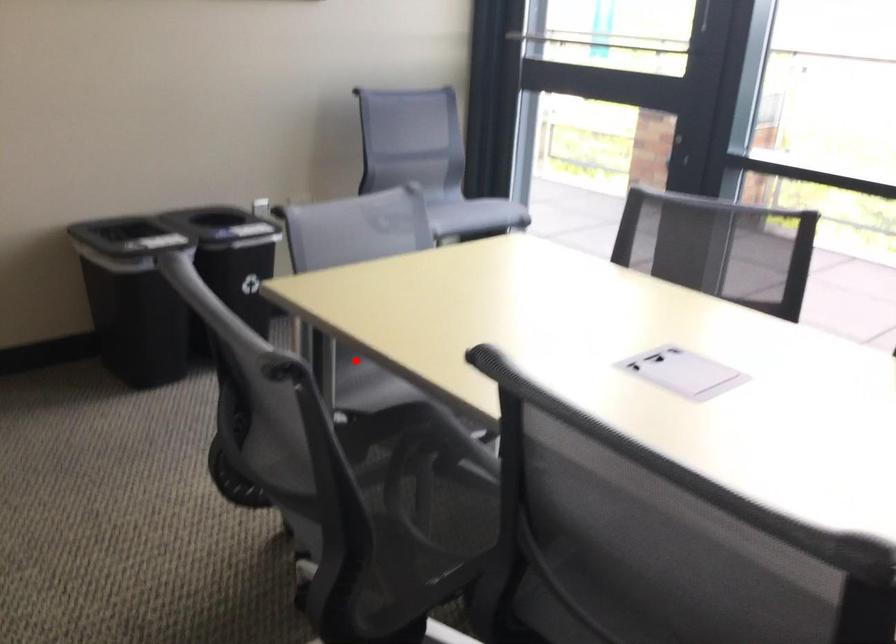
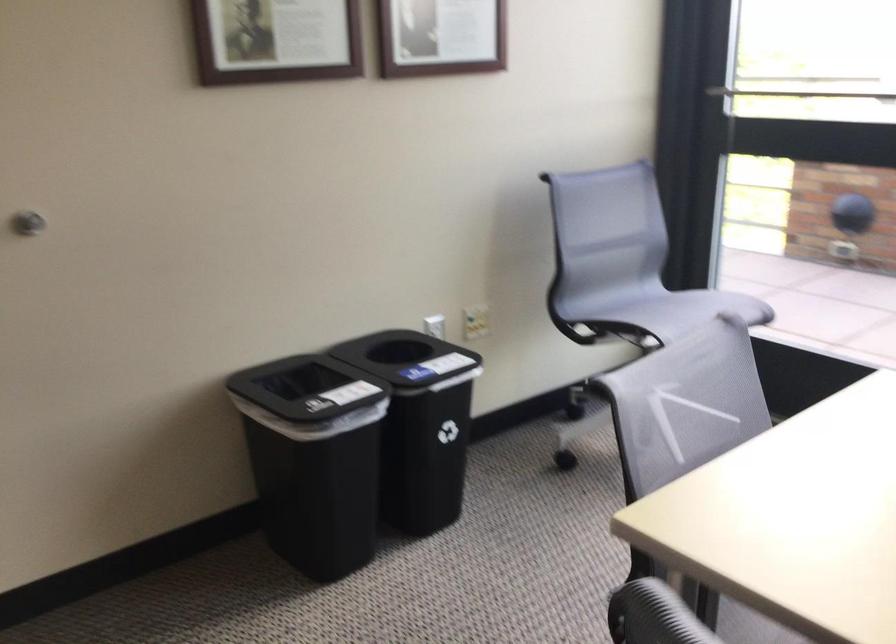
Question: I am providing you with two images of the same scene from different viewpoints. A red point is marked on the first image. Can you still see the location of the red point in image 2?

Choices:
 (A) Yes
 (B) No

Answer: (B)